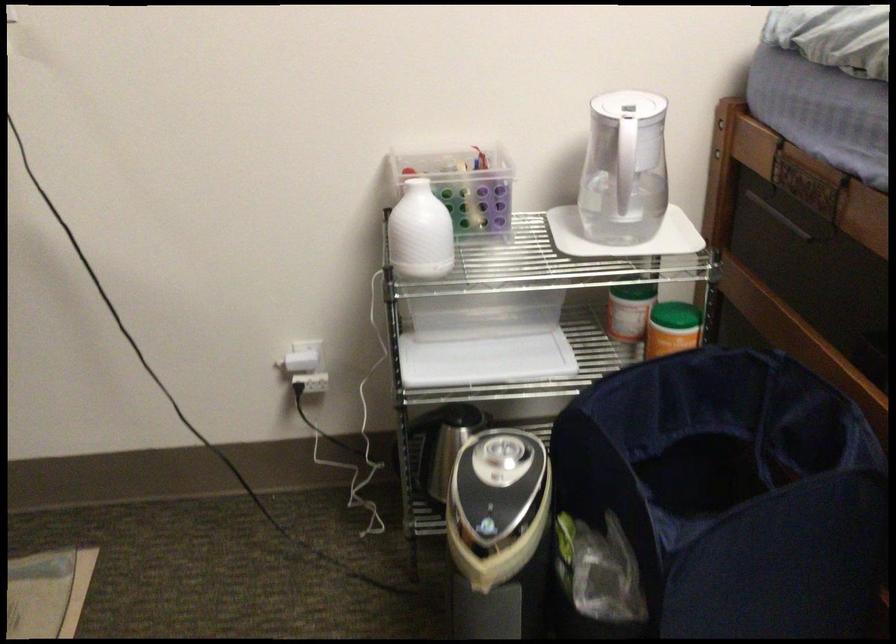
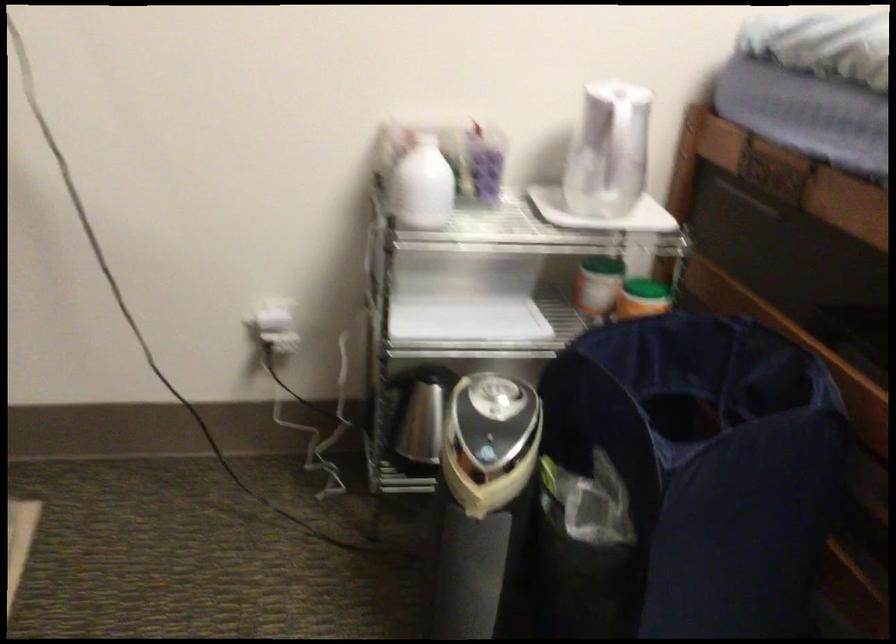
Locate, in the second image, the point that corresponds to [631,285] in the first image.

(602, 263)